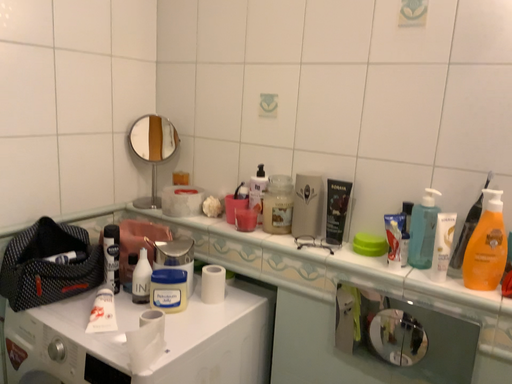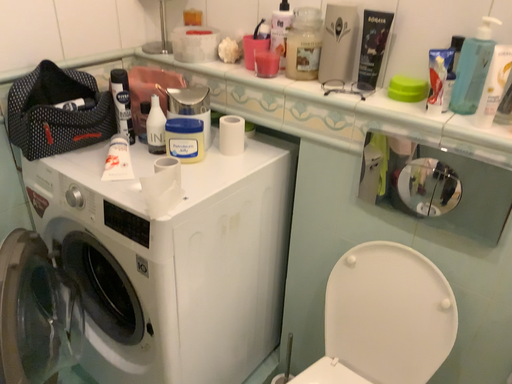
Question: Which way did the camera rotate in the video?

Choices:
 (A) rotated upward
 (B) rotated downward

Answer: (B)